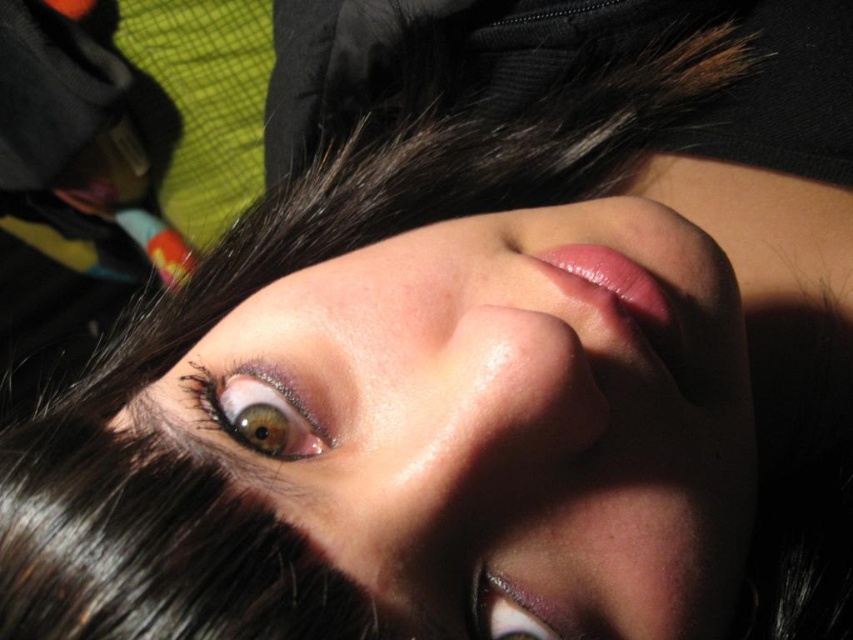
Is point (717, 586) farther from viewer compared to point (564, 625)?

Yes, point (717, 586) is behind point (564, 625).

Does smooth skin face at center have a lesser width compared to shiny brown eye at center?

No, smooth skin face at center is not thinner than shiny brown eye at center.

Find the location of `smooth skin face at center`. smooth skin face at center is located at coordinates (496, 417).

Identify the location of smooth skin face at center. Image resolution: width=853 pixels, height=640 pixels. (496, 417).

Does smooth skin face at center appear over shiny brown eye at upper left?

Indeed, smooth skin face at center is positioned over shiny brown eye at upper left.

Is smooth skin face at center smaller than shiny brown eye at upper left?

No.

Is point (526, 342) positioned after point (294, 404)?

No, it is in front of (294, 404).

The image size is (853, 640). I want to click on smooth skin face at center, so click(496, 417).

Does shiny brown eye at upper left have a greater height compared to shiny brown eye at center?

Indeed, shiny brown eye at upper left has a greater height compared to shiny brown eye at center.

Can you confirm if shiny brown eye at upper left is positioned below shiny brown eye at center?

No, shiny brown eye at upper left is not below shiny brown eye at center.

Which is behind, point (210, 385) or point (526, 605)?

The point (210, 385) is more distant.

Locate an element on the screen. shiny brown eye at upper left is located at coordinates (254, 412).